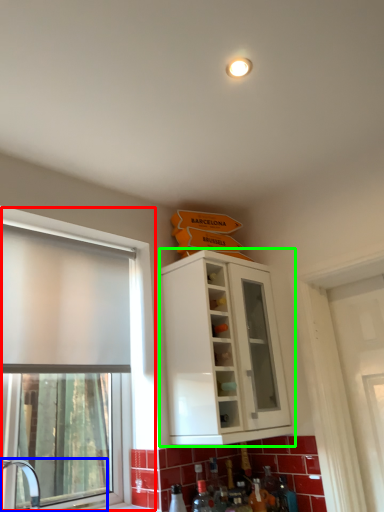
Question: Which object is positioned closest to window (highlighted by a red box)? Select from sink (highlighted by a blue box) and cabinetry (highlighted by a green box).

Choices:
 (A) sink
 (B) cabinetry

Answer: (A)